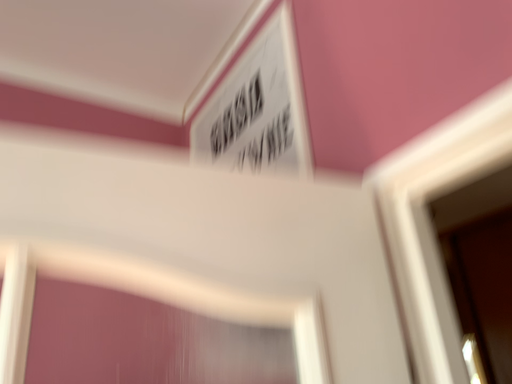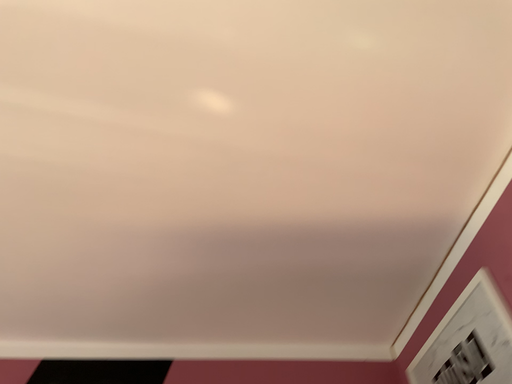
Question: How did the camera likely rotate when shooting the video?

Choices:
 (A) rotated left
 (B) rotated right

Answer: (A)